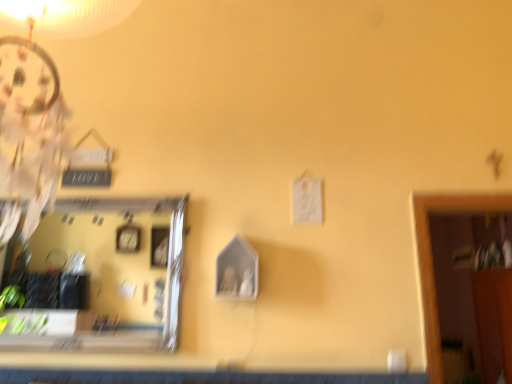
The image size is (512, 384). In order to click on clear glass mirror at left in this screenshot , I will do `click(100, 278)`.

What do you see at coordinates (100, 278) in the screenshot?
I see `clear glass mirror at left` at bounding box center [100, 278].

The image size is (512, 384). Identify the location of clear glass mirror at left. (100, 278).